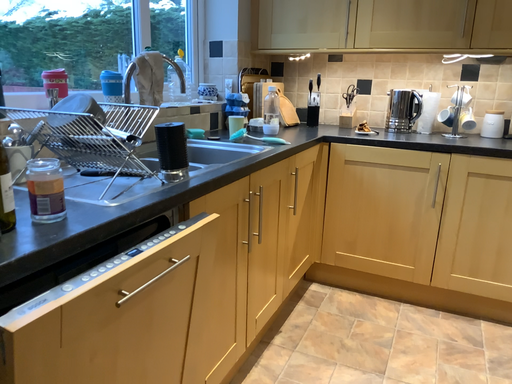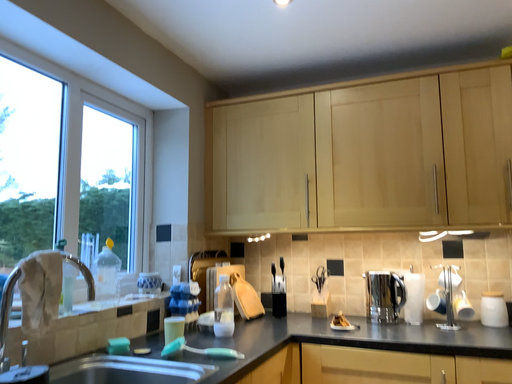
Question: Which way did the camera rotate in the video?

Choices:
 (A) rotated downward
 (B) rotated upward

Answer: (B)